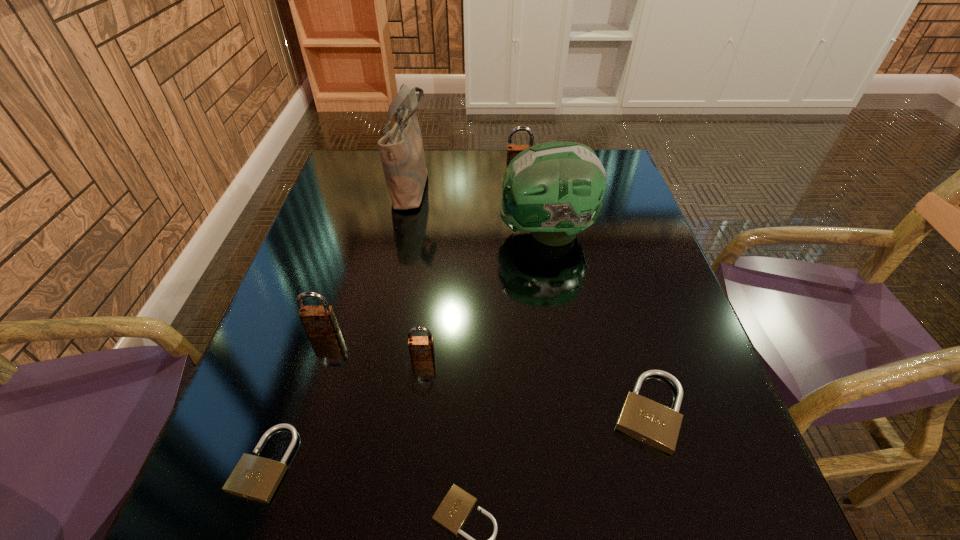
Image resolution: width=960 pixels, height=540 pixels. Identify the location of vacant area between the third shortest object and the leftmost beige padlock. (457, 437).

Choose which object is the fifth nearest neighbor to the rightmost padlock. Please provide its 2D coordinates. Your answer should be formatted as a tuple, i.e. [(x, y)], where the tuple contains the x and y coordinates of a point satisfying the conditions above.

[(256, 478)]

Identify which object is the third closest to the rightmost beige padlock. Please provide its 2D coordinates. Your answer should be formatted as a tuple, i.e. [(x, y)], where the tuple contains the x and y coordinates of a point satisfying the conditions above.

[(554, 190)]

Identify the location of padlock object that ranks as the fifth closest to the sixth tallest object. The image size is (960, 540). (512, 150).

You are a GUI agent. You are given a task and a screenshot of the screen. Output one action in this format:
    pyautogui.click(x=<x>, y=<y>)
    Task: Click on the padlock that is the second closest one to the football helmet
    
    Given the screenshot: What is the action you would take?
    pyautogui.click(x=421, y=348)

This screenshot has height=540, width=960. Identify the location of brown padlock object that ranks as the second closest to the tallest padlock. (318, 321).

Identify which brown padlock is the second closest to the third padlock from left to right. Please provide its 2D coordinates. Your answer should be formatted as a tuple, i.e. [(x, y)], where the tuple contains the x and y coordinates of a point satisfying the conditions above.

[(512, 150)]

This screenshot has height=540, width=960. Identify the location of beige padlock that is the second closest one to the third object from left to right. (652, 423).

You are a GUI agent. You are given a task and a screenshot of the screen. Output one action in this format:
    pyautogui.click(x=<x>, y=<y>)
    Task: Click on the beige padlock that can be found as the second closest to the farthest brown padlock
    The image size is (960, 540).
    Given the screenshot: What is the action you would take?
    pyautogui.click(x=256, y=478)

The image size is (960, 540). I want to click on free space that satisfies the following two spatial constraints: 1. on the visor of the sixth tallest object; 2. on the left side of the green football helmet, so click(575, 411).